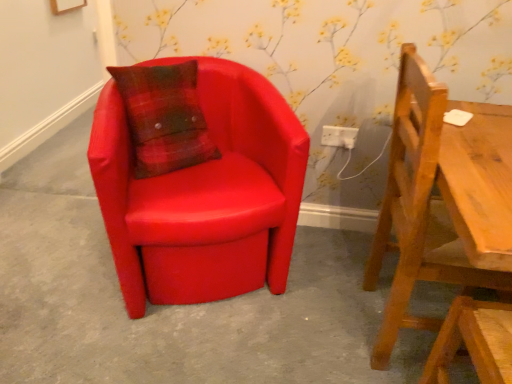
Question: Does matte leather chair at left, the second chair viewed from the right, come behind matte red chair at center?

Choices:
 (A) no
 (B) yes

Answer: (A)

Question: Is matte leather chair at left, acting as the 1th chair starting from the left, shorter than matte red chair at center?

Choices:
 (A) yes
 (B) no

Answer: (B)

Question: Is matte leather chair at left, the second chair viewed from the right, to the left of matte red chair at center from the viewer's perspective?

Choices:
 (A) yes
 (B) no

Answer: (B)

Question: Is matte leather chair at left, the second chair viewed from the right, in front of matte red chair at center?

Choices:
 (A) yes
 (B) no

Answer: (A)

Question: Considering the relative sizes of matte leather chair at left, the second chair viewed from the right, and matte red chair at center in the image provided, is matte leather chair at left, the second chair viewed from the right, bigger than matte red chair at center?

Choices:
 (A) no
 (B) yes

Answer: (B)

Question: Considering the relative sizes of matte red chair at center and wooden chair at right, the second chair from the left, in the image provided, is matte red chair at center thinner than wooden chair at right, the second chair from the left,?

Choices:
 (A) no
 (B) yes

Answer: (A)

Question: Can you confirm if matte red chair at center is smaller than wooden chair at right, the second chair from the left?

Choices:
 (A) no
 (B) yes

Answer: (B)

Question: Is matte red chair at center to the left of wooden chair at right, which is counted as the first chair, starting from the right, from the viewer's perspective?

Choices:
 (A) no
 (B) yes

Answer: (B)

Question: Is matte red chair at center shorter than wooden chair at right, which is counted as the first chair, starting from the right?

Choices:
 (A) no
 (B) yes

Answer: (B)

Question: Is matte red chair at center next to wooden chair at right, the second chair from the left?

Choices:
 (A) yes
 (B) no

Answer: (B)

Question: Can we say matte red chair at center lies outside wooden chair at right, which is counted as the first chair, starting from the right?

Choices:
 (A) no
 (B) yes

Answer: (B)

Question: Is wooden chair at right, which is counted as the first chair, starting from the right, bigger than matte leather chair at left, the second chair viewed from the right?

Choices:
 (A) no
 (B) yes

Answer: (A)